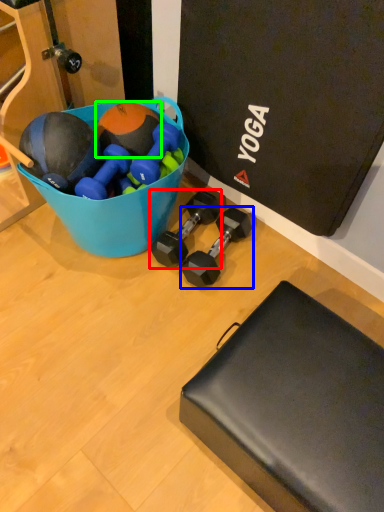
Question: Estimate the real-world distances between objects in this image. Which object is closer to dumbbell (highlighted by a red box), dumbbell (highlighted by a blue box) or sports equipment (highlighted by a green box)?

Choices:
 (A) dumbbell
 (B) sports equipment

Answer: (A)